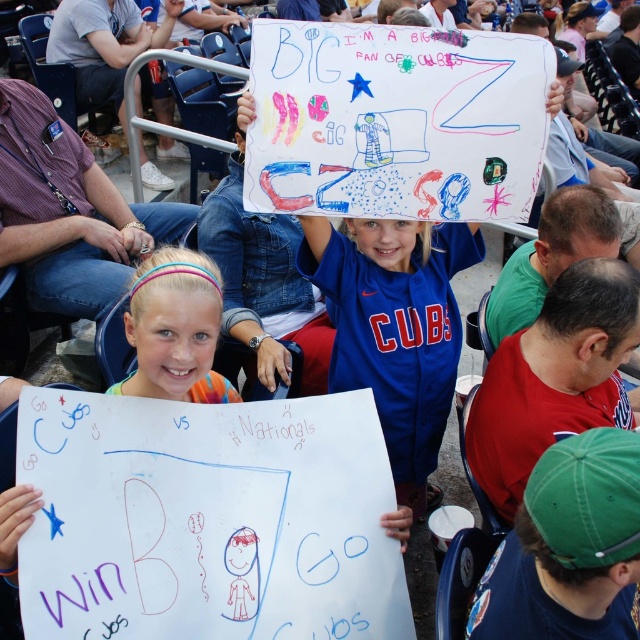
Is point (390, 292) farther from viewer compared to point (209, 326)?

That is True.

Who is positioned more to the left, blue jersey at center or pastel hairband at center?

Positioned to the left is pastel hairband at center.

Locate an element on the screen. The width and height of the screenshot is (640, 640). blue jersey at center is located at coordinates (394, 326).